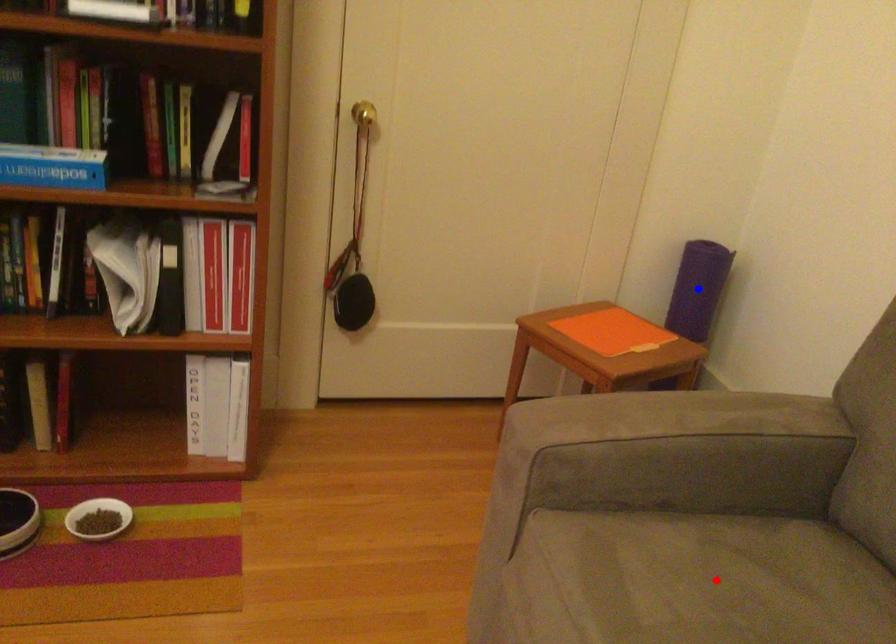
Question: In the image, two points are highlighted. Which point is nearer to the camera? Reply with the corresponding letter.

Choices:
 (A) blue point
 (B) red point

Answer: (B)